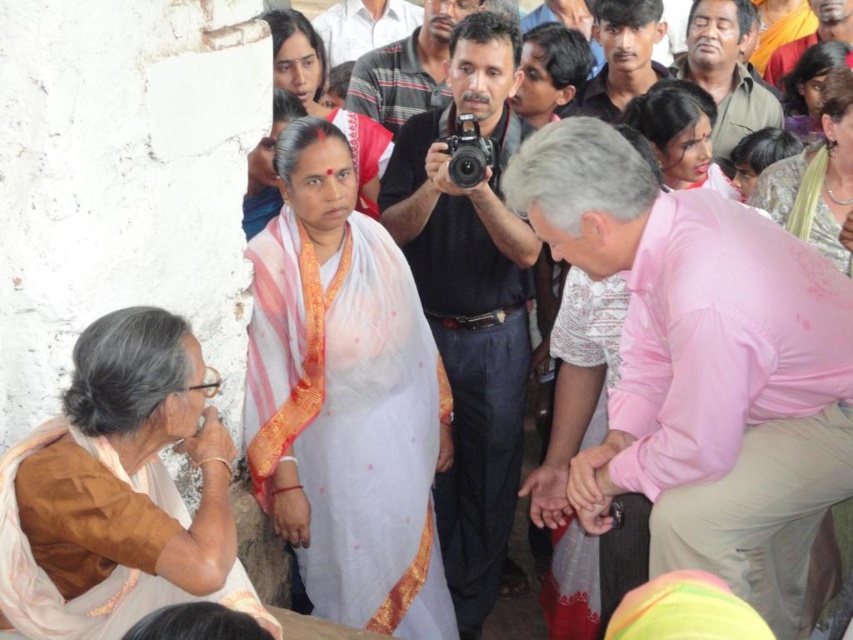
You are an event planner organizing a photo shoot for the cultural event depicted in the image. You need to position a large backdrop behind the two main subjects wearing the white sheer saree at center and the matte pink saree at upper right. Considering their current positions, which saree is more suitable for the backdrop placement to ensure both subjects are fully visible?

The white sheer saree at center is more suitable for backdrop placement because it occupies less space than the matte pink saree at upper right, allowing both subjects to be fully visible without overlapping.

You are standing in the crowd and want to move towards the two points labeled as point (258, 500) and point (828, 156). Which point should you head towards if you want to reach the one that is closer to you?

You should head towards point (258, 500) because it is closer to the viewer than point (828, 156).

You are organizing a fashion show and need to display the white sheer saree at center and the pink silk saree at upper right on two mannequins. If the mannequins are placed side by side, which saree would you place on the narrower mannequin?

The white sheer saree at center is thinner than the pink silk saree at upper right, so it should be placed on the narrower mannequin.